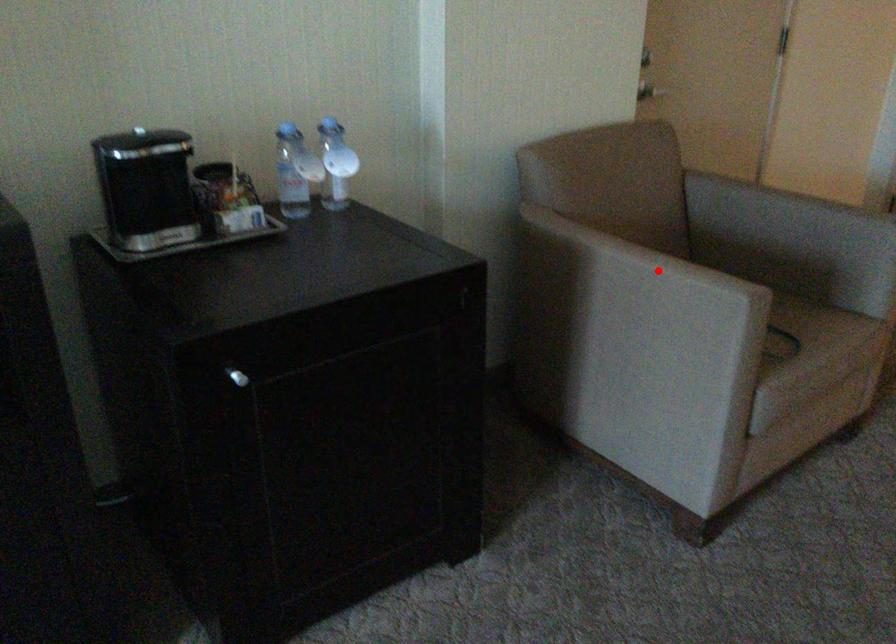
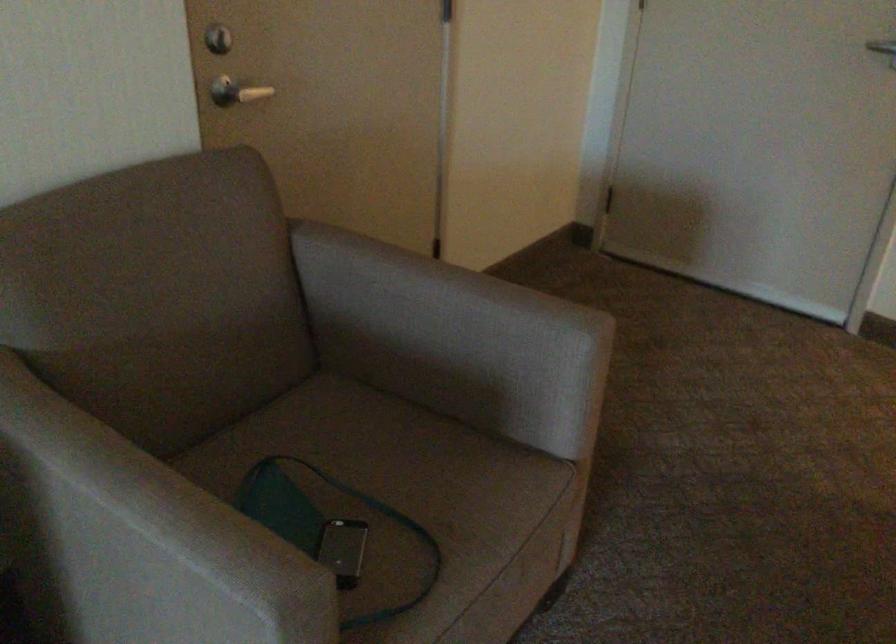
Locate, in the second image, the point that corresponds to the highlighted location in the first image.

(150, 538)